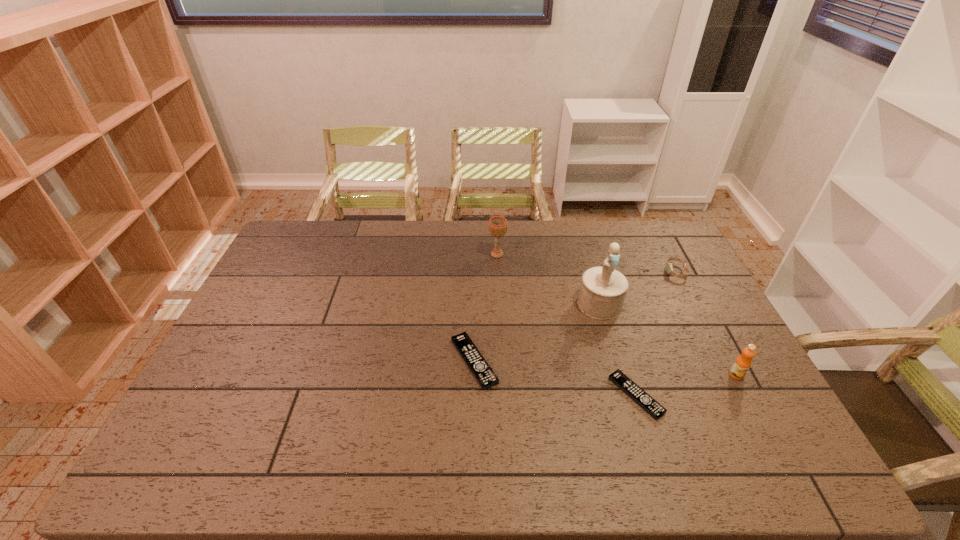
Where is `free space between the fifth nearest object and the orange juice`? This screenshot has width=960, height=540. free space between the fifth nearest object and the orange juice is located at coordinates (706, 323).

At what (x,y) coordinates should I click in order to perform the action: click on free spot between the fifth shortest object and the second farthest object. Please return your answer as a coordinate pair (x, y). The height and width of the screenshot is (540, 960). Looking at the image, I should click on (587, 263).

Locate an element on the screen. This screenshot has width=960, height=540. free space between the shorter remote control and the second shortest object is located at coordinates (555, 378).

This screenshot has width=960, height=540. What are the coordinates of `free space between the fourth nearest object and the second tallest object` in the screenshot? It's located at (548, 279).

Where is `empty space that is in between the shorter remote control and the fourth shortest object`? empty space that is in between the shorter remote control and the fourth shortest object is located at coordinates (686, 385).

Where is `vacant area that lies between the orange juice and the shorter remote control`? This screenshot has width=960, height=540. vacant area that lies between the orange juice and the shorter remote control is located at coordinates (686, 385).

You are a GUI agent. You are given a task and a screenshot of the screen. Output one action in this format:
    pyautogui.click(x=<x>, y=<y>)
    Task: Click on the vacant region between the third farthest object and the fourth tallest object
    The height and width of the screenshot is (540, 960).
    Given the screenshot: What is the action you would take?
    tap(637, 288)

I want to click on free space between the farthest object and the taller remote control, so click(x=486, y=308).

The height and width of the screenshot is (540, 960). What are the coordinates of `vacant area that lies between the fifth shortest object and the figurine` in the screenshot? It's located at (548, 279).

This screenshot has width=960, height=540. In order to click on free space between the shortest object and the farthest object in this screenshot , I will do `click(566, 325)`.